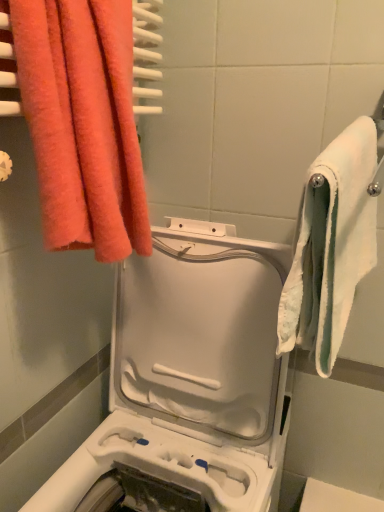
Question: From a real-world perspective, is white soft towel at right, the first towel in the right-to-left sequence, below fluffy coral towel at upper left, the 2th towel in the right-to-left sequence?

Choices:
 (A) yes
 (B) no

Answer: (A)

Question: Does white soft towel at right, placed as the second towel when sorted from left to right, contain fluffy coral towel at upper left, the 2th towel in the right-to-left sequence?

Choices:
 (A) no
 (B) yes

Answer: (A)

Question: From a real-world perspective, does white soft towel at right, placed as the second towel when sorted from left to right, stand above fluffy coral towel at upper left, which is the 1th towel in left-to-right order?

Choices:
 (A) no
 (B) yes

Answer: (A)

Question: Is white soft towel at right, the first towel in the right-to-left sequence, to the right of fluffy coral towel at upper left, which is the 1th towel in left-to-right order, from the viewer's perspective?

Choices:
 (A) no
 (B) yes

Answer: (B)

Question: From the image's perspective, is white soft towel at right, placed as the second towel when sorted from left to right, on top of fluffy coral towel at upper left, the 2th towel in the right-to-left sequence?

Choices:
 (A) no
 (B) yes

Answer: (A)

Question: Can you confirm if white soft towel at right, placed as the second towel when sorted from left to right, is taller than fluffy coral towel at upper left, the 2th towel in the right-to-left sequence?

Choices:
 (A) yes
 (B) no

Answer: (B)

Question: Is white fabric towel at right bigger than white plastic washing machine at center?

Choices:
 (A) yes
 (B) no

Answer: (B)

Question: Is white fabric towel at right looking in the opposite direction of white plastic washing machine at center?

Choices:
 (A) no
 (B) yes

Answer: (A)

Question: Would you say white fabric towel at right is outside white plastic washing machine at center?

Choices:
 (A) yes
 (B) no

Answer: (A)

Question: Can you confirm if white fabric towel at right is positioned to the left of white plastic washing machine at center?

Choices:
 (A) no
 (B) yes

Answer: (A)

Question: Considering the relative sizes of white fabric towel at right and white plastic washing machine at center in the image provided, is white fabric towel at right taller than white plastic washing machine at center?

Choices:
 (A) yes
 (B) no

Answer: (B)

Question: Considering the relative positions of white fabric towel at right and white plastic washing machine at center in the image provided, is white fabric towel at right to the right of white plastic washing machine at center from the viewer's perspective?

Choices:
 (A) no
 (B) yes

Answer: (B)

Question: Is white soft towel at right, the first towel in the right-to-left sequence, facing towards white plastic washing machine at center?

Choices:
 (A) yes
 (B) no

Answer: (B)